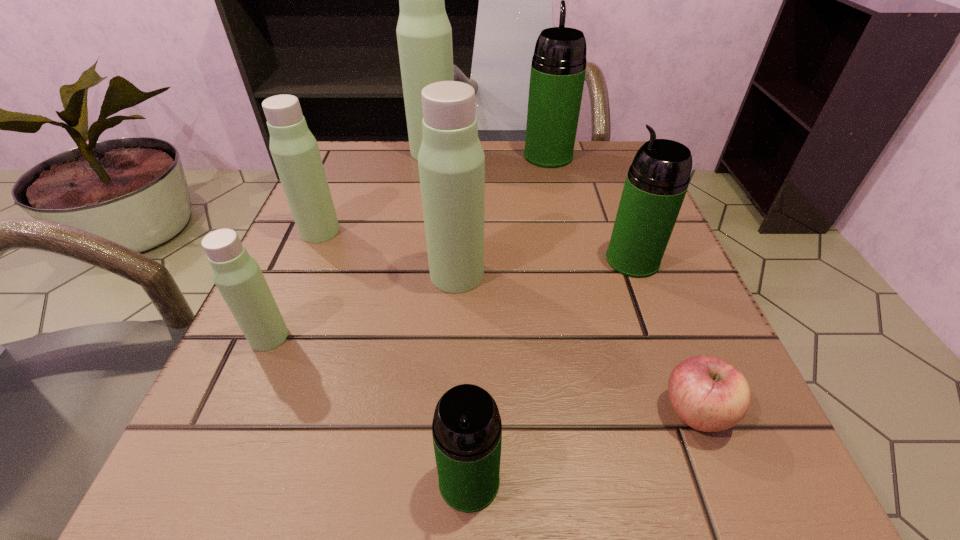
Find the location of a particular element. The height and width of the screenshot is (540, 960). free space at the far left corner is located at coordinates (335, 145).

Find the location of a particular element. This screenshot has height=540, width=960. free space at the near left corner of the desktop is located at coordinates (247, 446).

Where is `vacant point located between the tallest object and the farthest green thermos bottle`? vacant point located between the tallest object and the farthest green thermos bottle is located at coordinates (491, 154).

The height and width of the screenshot is (540, 960). I want to click on empty location between the third object from right to left and the rightmost thermos bottle, so click(x=590, y=208).

What are the coordinates of `free point between the second nearest light thermos bottle and the biggest green thermos bottle` in the screenshot? It's located at (503, 215).

The height and width of the screenshot is (540, 960). I want to click on vacant region between the second nearest light thermos bottle and the farthest green thermos bottle, so click(503, 215).

Where is `free spot between the apple and the third object from right to left`? This screenshot has height=540, width=960. free spot between the apple and the third object from right to left is located at coordinates (622, 284).

Locate an element on the screen. The height and width of the screenshot is (540, 960). empty space that is in between the second biggest light thermos bottle and the apple is located at coordinates (576, 343).

Image resolution: width=960 pixels, height=540 pixels. Identify the location of free space that is in between the second nearest light thermos bottle and the farthest green thermos bottle. (503, 215).

Find the location of `free spot between the leftmost green thermos bottle and the second nearest light thermos bottle`. free spot between the leftmost green thermos bottle and the second nearest light thermos bottle is located at coordinates (463, 377).